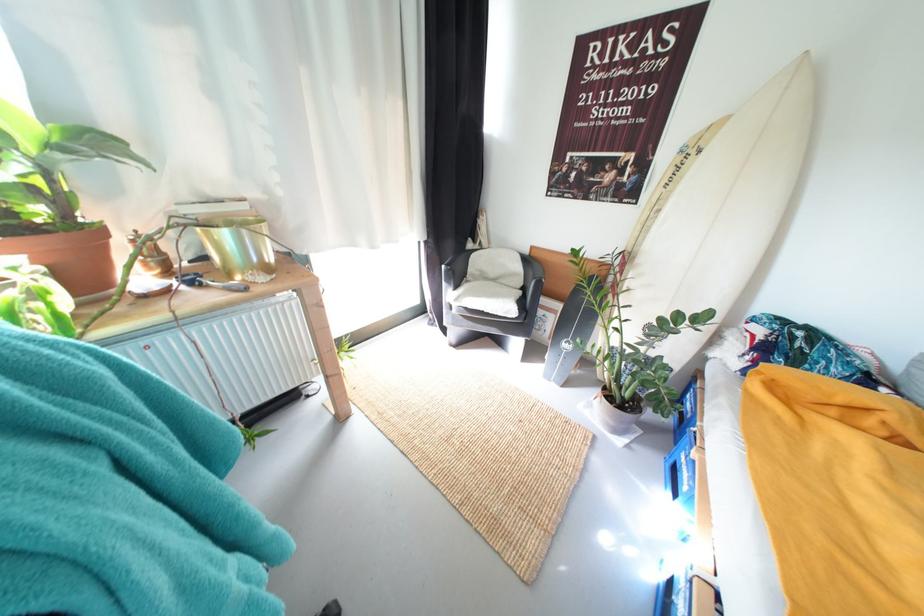
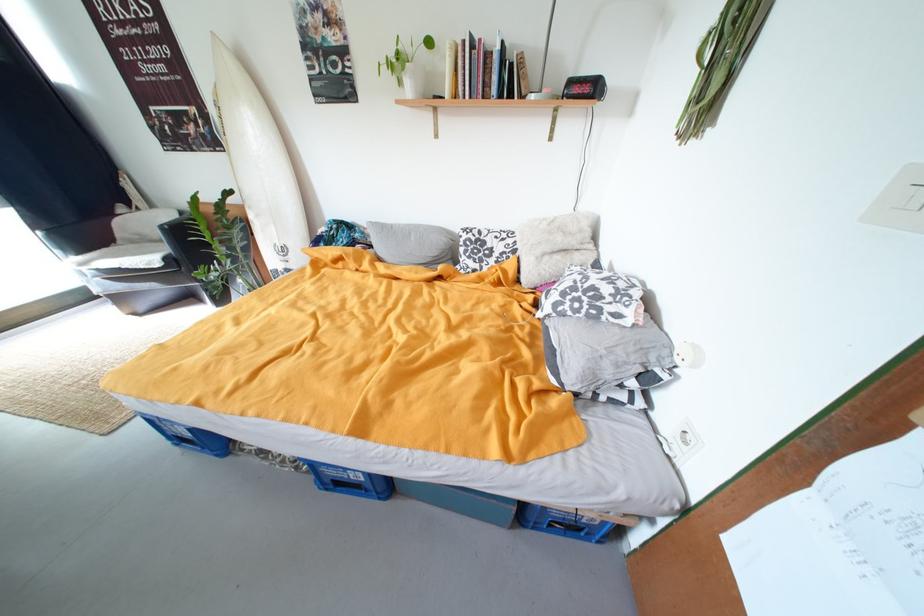
Where in the second image is the point corresponding to (697,155) from the first image?

(225, 108)